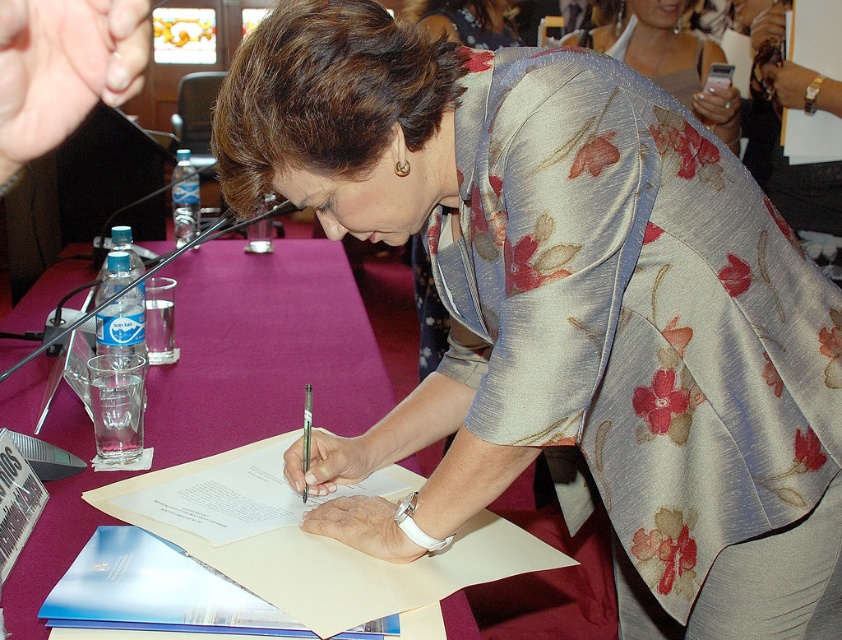
Question: Which object is farther from the camera taking this photo?

Choices:
 (A) purple fabric table at center
 (B) floral silk blouse at center
 (C) white paper at center

Answer: (A)

Question: Which point is closer to the camera?

Choices:
 (A) (285, 604)
 (B) (638, 65)
 (C) (552, 67)
 (D) (233, 408)

Answer: (C)

Question: Does purple fabric table at center come in front of floral silk kimono at upper center?

Choices:
 (A) no
 (B) yes

Answer: (B)

Question: Which of these objects is positioned farthest from the white paper at center?

Choices:
 (A) floral silk kimono at upper center
 (B) floral silk blouse at center

Answer: (A)

Question: In this image, where is floral silk blouse at center located relative to purple fabric table at center?

Choices:
 (A) left
 (B) right

Answer: (B)

Question: Where is floral silk blouse at center located in relation to purple fabric table at center in the image?

Choices:
 (A) left
 (B) right

Answer: (B)